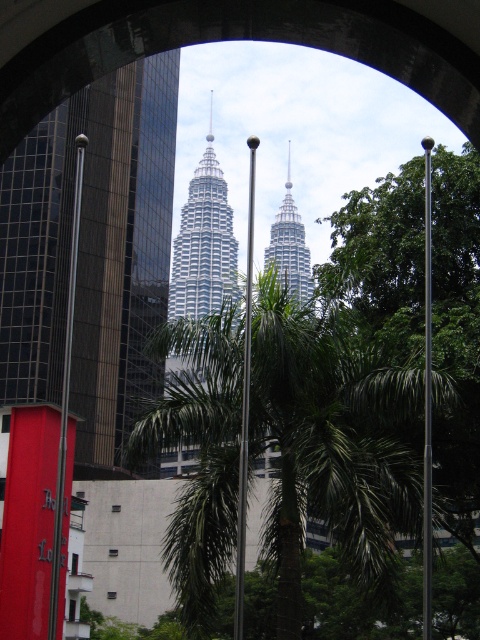
You are a photographer planning to capture the Petronas Twin Towers through the arched opening while including the foreground poles. Based on the scene description, which object would appear larger in your photo, the glassy reflective skyscraper at left or the silver metallic twin towers at center?

The silver metallic twin towers at center would appear larger in the photo because they are taller than the glassy reflective skyscraper at left.

You are standing at the arched opening looking towards the city. There is a point marked at coordinates (428,401). What object is located at that point?

The point at (428,401) corresponds to the polished metal pole at center.

You are an architect analyzing the composition of this scene. Considering the polished metal pole at center and the silver metallic twin towers at center, which object takes up more visual space in the image?

The silver metallic twin towers at center take up more visual space than the polished metal pole at center, as they occupy a larger portion of the image according to the description.